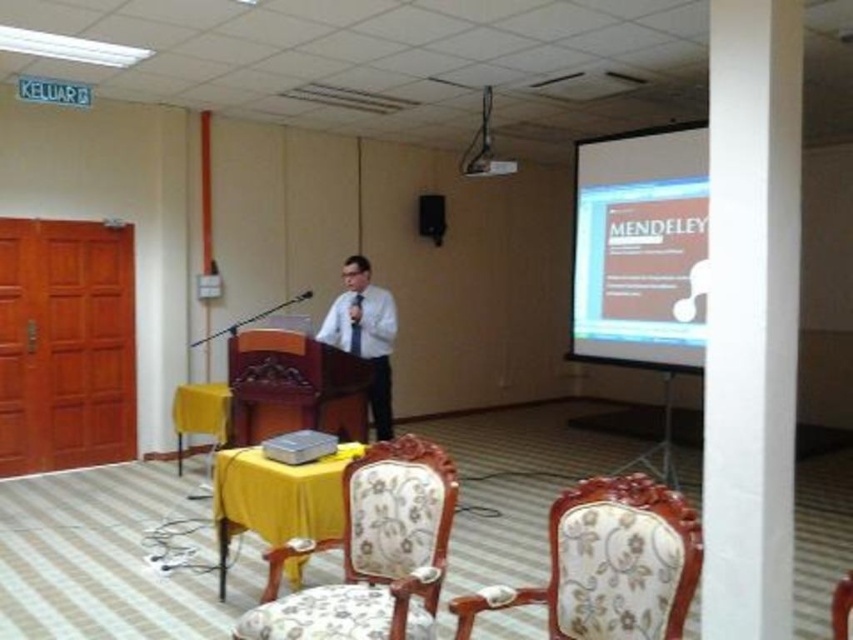
Can you confirm if white smooth pillar at center right is positioned to the right of black satin tie at center?

Yes, white smooth pillar at center right is to the right of black satin tie at center.

Is white smooth pillar at center right to the left of black satin tie at center from the viewer's perspective?

In fact, white smooth pillar at center right is to the right of black satin tie at center.

Does point (764, 147) come in front of point (360, 328)?

Yes, point (764, 147) is closer to viewer.

Locate an element on the screen. white smooth pillar at center right is located at coordinates (751, 317).

Is matte black speaker at upper center positioned before black plastic projector at upper center?

Yes, matte black speaker at upper center is in front of black plastic projector at upper center.

Can you confirm if matte black speaker at upper center is positioned to the right of black plastic projector at upper center?

No, matte black speaker at upper center is not to the right of black plastic projector at upper center.

Which is in front, point (416, 227) or point (485, 156)?

Point (485, 156)

Find the location of a particular element. Image resolution: width=853 pixels, height=640 pixels. matte black speaker at upper center is located at coordinates (431, 216).

Between white matte projection screen at upper right and matte black speaker at upper center, which one has less height?

matte black speaker at upper center

Can you confirm if white matte projection screen at upper right is smaller than matte black speaker at upper center?

No, white matte projection screen at upper right is not smaller than matte black speaker at upper center.

This screenshot has width=853, height=640. Describe the element at coordinates (640, 248) in the screenshot. I see `white matte projection screen at upper right` at that location.

In order to click on white matte projection screen at upper right in this screenshot , I will do `click(640, 248)`.